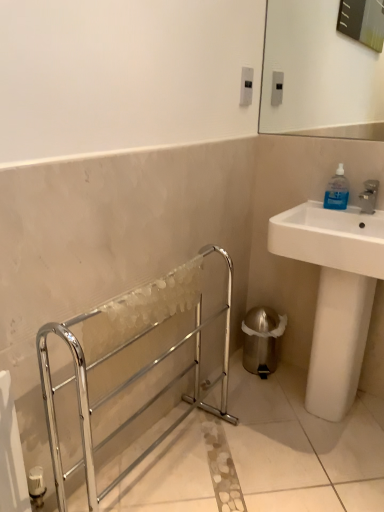
Image resolution: width=384 pixels, height=512 pixels. I want to click on chrome metallic towel rack at left, so click(x=124, y=385).

Describe the element at coordinates (124, 385) in the screenshot. The image size is (384, 512). I see `chrome metallic towel rack at left` at that location.

What is the approximate width of blue translucent bottle at upper right?

It is 3.47 inches.

Identify the location of chrome metallic towel rack at left. Image resolution: width=384 pixels, height=512 pixels. (124, 385).

From the picture: Considering the relative positions of chrome metallic towel rack at left and white glossy sink at right in the image provided, is chrome metallic towel rack at left to the left of white glossy sink at right from the viewer's perspective?

Correct, you'll find chrome metallic towel rack at left to the left of white glossy sink at right.

Is chrome metallic towel rack at left positioned beyond the bounds of white glossy sink at right?

That's correct, chrome metallic towel rack at left is outside of white glossy sink at right.

Which object is further away from the camera taking this photo, chrome metallic towel rack at left or white glossy sink at right?

white glossy sink at right.

From a real-world perspective, which object rests below the other?

chrome metallic towel rack at left.

Is white glossy sink at right situated inside blue translucent bottle at upper right or outside?

white glossy sink at right is not inside blue translucent bottle at upper right, it's outside.

Between white glossy sink at right and blue translucent bottle at upper right, which one has more height?

With more height is white glossy sink at right.

Is white glossy sink at right in front of or behind blue translucent bottle at upper right in the image?

white glossy sink at right is positioned closer to the viewer than blue translucent bottle at upper right.

Is there a large distance between blue translucent bottle at upper right and white glossy sink at right?

That's not correct — blue translucent bottle at upper right is a little close to white glossy sink at right.

Is blue translucent bottle at upper right taller or shorter than white glossy sink at right?

In the image, blue translucent bottle at upper right appears to be shorter than white glossy sink at right.

Based on their sizes in the image, would you say blue translucent bottle at upper right is bigger or smaller than white glossy sink at right?

In the image, blue translucent bottle at upper right appears to be smaller than white glossy sink at right.

Is blue translucent bottle at upper right facing away from chrome metallic towel rack at left?

No, chrome metallic towel rack at left is not at the back of blue translucent bottle at upper right.

Which of these two, blue translucent bottle at upper right or chrome metallic towel rack at left, stands shorter?

blue translucent bottle at upper right is shorter.

Would you say chrome metallic towel rack at left is part of blue translucent bottle at upper right's contents?

No, chrome metallic towel rack at left is not surrounded by blue translucent bottle at upper right.

Based on their positions, is blue translucent bottle at upper right located to the left or right of chrome metallic towel rack at left?

blue translucent bottle at upper right is positioned on chrome metallic towel rack at left's right side.

Considering the positions of objects chrome metallic towel rack at left and blue translucent bottle at upper right in the image provided, who is more to the left, chrome metallic towel rack at left or blue translucent bottle at upper right?

chrome metallic towel rack at left is more to the left.

Considering the sizes of objects chrome metallic towel rack at left and blue translucent bottle at upper right in the image provided, who is thinner, chrome metallic towel rack at left or blue translucent bottle at upper right?

Thinner between the two is blue translucent bottle at upper right.

Considering the positions of objects chrome metallic towel rack at left and blue translucent bottle at upper right in the image provided, who is in front, chrome metallic towel rack at left or blue translucent bottle at upper right?

Positioned in front is chrome metallic towel rack at left.

Which object is positioned more to the right, white glossy sink at right or chrome metallic towel rack at left?

white glossy sink at right.

Is white glossy sink at right oriented away from chrome metallic towel rack at left?

white glossy sink at right is not turned away from chrome metallic towel rack at left.

In terms of height, does white glossy sink at right look taller or shorter compared to chrome metallic towel rack at left?

Clearly, white glossy sink at right is taller compared to chrome metallic towel rack at left.

Locate an element on the screen. sink that appears on the right of chrome metallic towel rack at left is located at coordinates (334, 294).

Identify the location of bottle that is above the white glossy sink at right (from the image's perspective). (337, 191).

Considering their positions, is chrome metallic towel rack at left positioned closer to white glossy sink at right than blue translucent bottle at upper right?

Answer: Among the two, blue translucent bottle at upper right is located nearer to white glossy sink at right.

Estimate the real-world distances between objects in this image. Which object is closer to blue translucent bottle at upper right, chrome metallic towel rack at left or white glossy sink at right?

Among the two, white glossy sink at right is located nearer to blue translucent bottle at upper right.

Estimate the real-world distances between objects in this image. Which object is further from chrome metallic towel rack at left, white glossy sink at right or blue translucent bottle at upper right?

blue translucent bottle at upper right lies further to chrome metallic towel rack at left than the other object.

From the image, which object appears to be nearer to chrome metallic towel rack at left, blue translucent bottle at upper right or white glossy sink at right?

white glossy sink at right lies closer to chrome metallic towel rack at left than the other object.

Looking at the image, which one is located closer to white glossy sink at right, blue translucent bottle at upper right or chrome metallic towel rack at left?

→ blue translucent bottle at upper right is closer to white glossy sink at right.

Looking at the image, which one is located closer to blue translucent bottle at upper right, white glossy sink at right or chrome metallic towel rack at left?

Based on the image, white glossy sink at right appears to be nearer to blue translucent bottle at upper right.

Where is `bottle located between chrome metallic towel rack at left and white glossy sink at right in the left-right direction`? bottle located between chrome metallic towel rack at left and white glossy sink at right in the left-right direction is located at coordinates (337, 191).